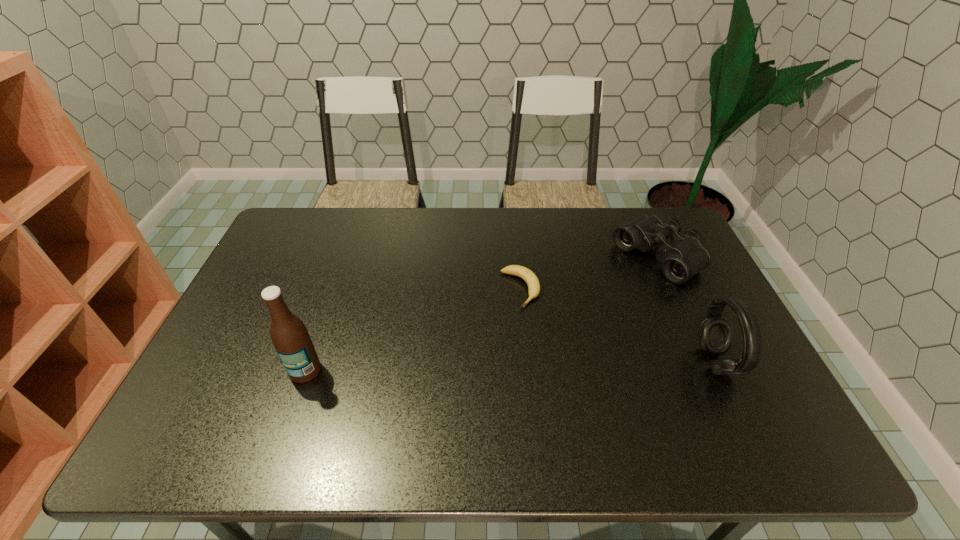
This screenshot has width=960, height=540. Find the location of `object that is positioned at the near right corner`. object that is positioned at the near right corner is located at coordinates point(715,333).

Locate an element on the screen. Image resolution: width=960 pixels, height=540 pixels. free space at the far edge of the desktop is located at coordinates (442, 246).

Image resolution: width=960 pixels, height=540 pixels. Find the location of `vacant space at the near edge of the desktop`. vacant space at the near edge of the desktop is located at coordinates (576, 410).

The height and width of the screenshot is (540, 960). What are the coordinates of `vacant space at the left edge` in the screenshot? It's located at [x=261, y=311].

What are the coordinates of `vacant space at the right edge of the desktop` in the screenshot? It's located at (695, 307).

The height and width of the screenshot is (540, 960). What are the coordinates of `vacant space at the far left corner of the desktop` in the screenshot? It's located at (310, 208).

Image resolution: width=960 pixels, height=540 pixels. Identify the location of vacant region at the near left corner of the desktop. (243, 407).

Where is `free point between the headset and the tallest object`? The width and height of the screenshot is (960, 540). free point between the headset and the tallest object is located at coordinates (511, 366).

The height and width of the screenshot is (540, 960). What are the coordinates of `empty space that is in between the banana and the second tallest object` in the screenshot? It's located at (618, 326).

Where is `free space between the third tallest object and the beer bottle`? Image resolution: width=960 pixels, height=540 pixels. free space between the third tallest object and the beer bottle is located at coordinates (481, 314).